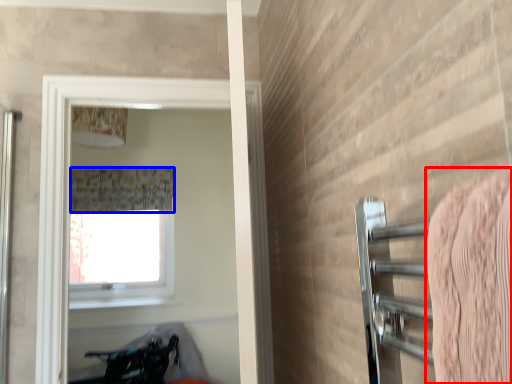
Question: Which point is closer to the camera, bath towel (highlighted by a red box) or shower curtain (highlighted by a blue box)?

Choices:
 (A) bath towel
 (B) shower curtain

Answer: (A)